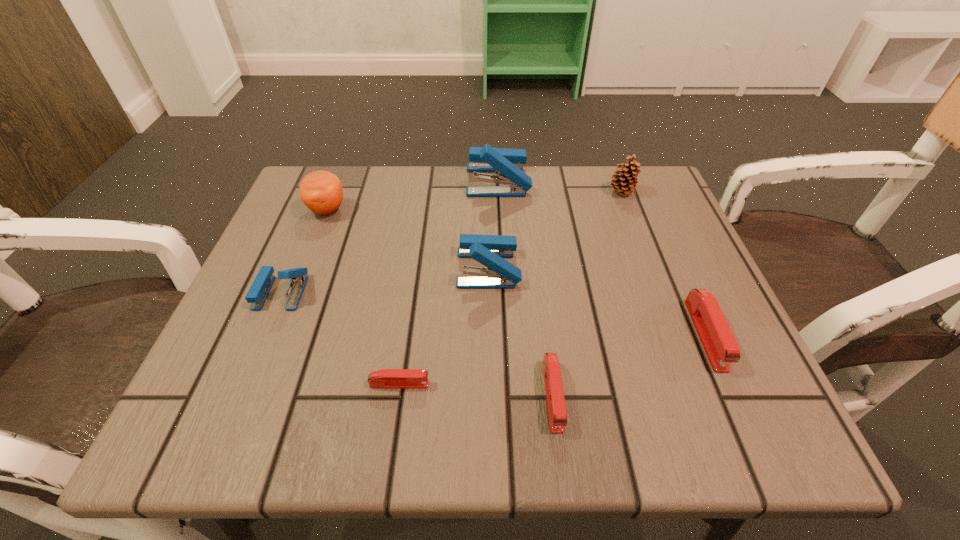
Find the location of a particular element. Image resolution: width=960 pixels, height=540 pixels. the farthest stapler is located at coordinates (508, 163).

This screenshot has width=960, height=540. What are the coordinates of `the farthest blue stapler` in the screenshot? It's located at (508, 163).

The image size is (960, 540). What are the coordinates of `orange` in the screenshot? It's located at (321, 191).

Identify the location of pinecone. (623, 184).

Identify the location of the second biggest blue stapler. The height and width of the screenshot is (540, 960). (489, 250).

Identify the location of the third tallest stapler. (261, 286).

The height and width of the screenshot is (540, 960). I want to click on the leftmost stapler, so click(261, 286).

Identify the location of the biggest red stapler. Image resolution: width=960 pixels, height=540 pixels. (718, 341).

Locate an element on the screen. This screenshot has height=540, width=960. the rightmost object is located at coordinates (718, 341).

Where is `the seventh tallest object`? The image size is (960, 540). the seventh tallest object is located at coordinates (557, 415).